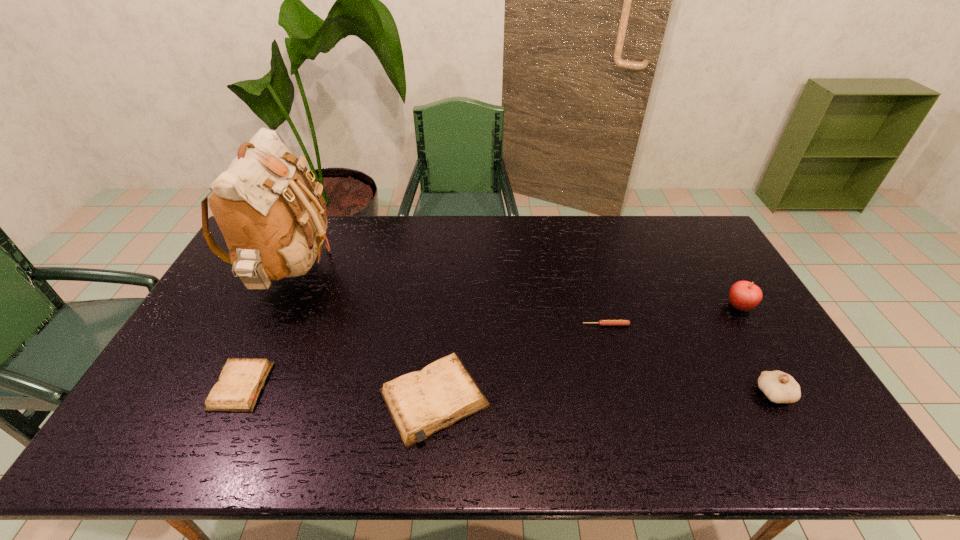
Select which object appears as the third closest to the right diary. Please provide its 2D coordinates. Your answer should be formatted as a tuple, i.e. [(x, y)], where the tuple contains the x and y coordinates of a point satisfying the conditions above.

[(240, 383)]

Identify which object is the fifth nearest to the right diary. Please provide its 2D coordinates. Your answer should be formatted as a tuple, i.e. [(x, y)], where the tuple contains the x and y coordinates of a point satisfying the conditions above.

[(743, 295)]

What are the coordinates of `free space in the image that satisfies the following two spatial constraints: 1. on the back side of the apple; 2. on the left side of the taller diary` in the screenshot? It's located at (443, 306).

Locate an element on the screen. free space that satisfies the following two spatial constraints: 1. on the front-facing side of the backpack; 2. on the right side of the shorter diary is located at coordinates (x=236, y=386).

Find the location of a particular element. Image resolution: width=960 pixels, height=540 pixels. free location that satisfies the following two spatial constraints: 1. on the front-facing side of the tallest object; 2. on the back side of the shorter diary is located at coordinates (236, 386).

Find the location of `free space that satisfies the following two spatial constraints: 1. on the front-facing side of the third shortest object; 2. on the left side of the tallest object`. free space that satisfies the following two spatial constraints: 1. on the front-facing side of the third shortest object; 2. on the left side of the tallest object is located at coordinates (229, 399).